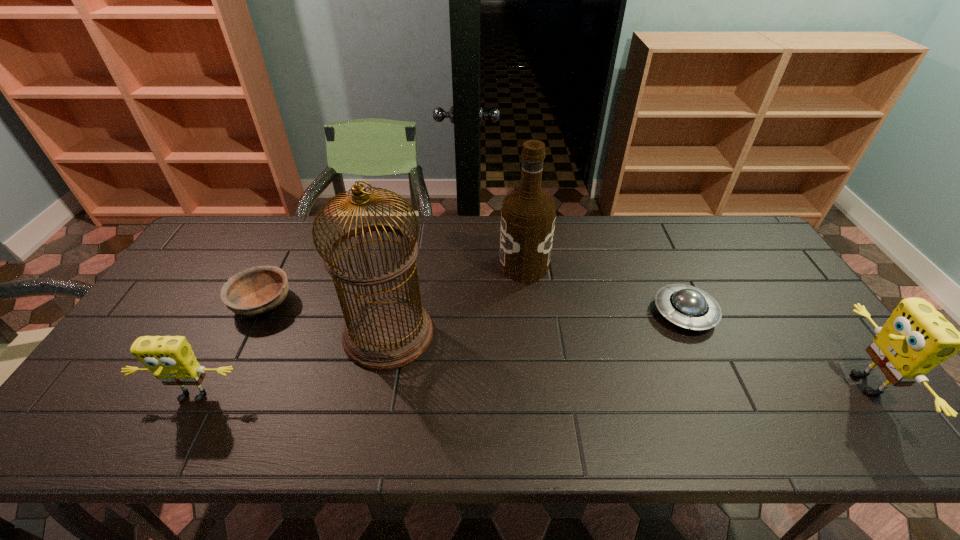
Find the location of a particular element. object at the near left corner is located at coordinates point(171,359).

The height and width of the screenshot is (540, 960). In order to click on object situated at the near right corner in this screenshot , I will do [916, 338].

At what (x,y) coordinates should I click in order to perform the action: click on free space at the far edge of the desktop. Please return your answer as a coordinate pair (x, y). The height and width of the screenshot is (540, 960). Looking at the image, I should click on (565, 233).

Where is `free region at the near edge of the desktop`? free region at the near edge of the desktop is located at coordinates (407, 403).

In the image, there is a desktop. At what (x,y) coordinates should I click in order to perform the action: click on free space at the right edge. Please return your answer as a coordinate pair (x, y). This screenshot has height=540, width=960. Looking at the image, I should click on (807, 312).

In the image, there is a desktop. At what (x,y) coordinates should I click in order to perform the action: click on vacant space at the far left corner. Please return your answer as a coordinate pair (x, y). The width and height of the screenshot is (960, 540). Looking at the image, I should click on tap(238, 260).

The height and width of the screenshot is (540, 960). Find the location of `free space at the far right corner of the desktop`. free space at the far right corner of the desktop is located at coordinates (732, 245).

Locate an element on the screen. This screenshot has width=960, height=540. free space between the birdcage and the bowl is located at coordinates (325, 319).

Locate an element on the screen. free space between the bowl and the fourth object from left to right is located at coordinates (393, 284).

This screenshot has height=540, width=960. Identify the location of free spot between the fifth object from left to right and the left sponge. (439, 355).